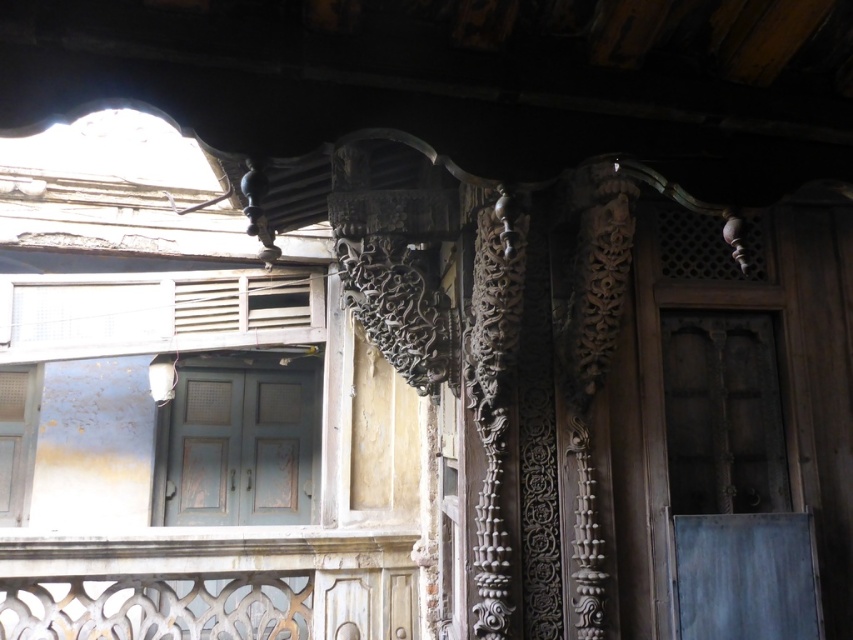
You are standing in front of the wooden structure and want to locate the matte blue door at center. According to the coordinates provided, where should you look to find it?

The matte blue door at center is located at coordinates point 0.700 on the x axis and 0.283 on the y axis.

You are standing in front of the wooden structure and notice the matte blue door at center and the white painted wood at lower left. Which object is positioned more to the left side of the scene?

The white painted wood at lower left is positioned more to the left side of the scene compared to the matte blue door at center.